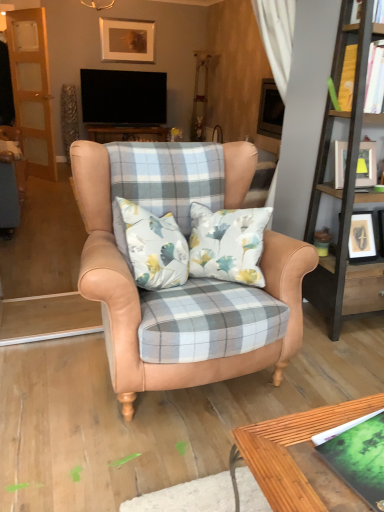
Question: Can you confirm if green matte book at lower right, the second book in the top-to-bottom sequence, is bigger than matte gold picture frame at upper center, which is counted as the 1th picture frame, starting from the top?

Choices:
 (A) yes
 (B) no

Answer: (B)

Question: Is green matte book at lower right, the 1th book in the bottom-to-top sequence, positioned before matte gold picture frame at upper center, which is the second picture frame in right-to-left order?

Choices:
 (A) no
 (B) yes

Answer: (B)

Question: Does green matte book at lower right, the 1th book in the bottom-to-top sequence, have a smaller size compared to matte gold picture frame at upper center, which appears as the 2th picture frame when viewed from the front?

Choices:
 (A) no
 (B) yes

Answer: (B)

Question: From the image's perspective, is green matte book at lower right, the 2th book in the right-to-left sequence, above matte gold picture frame at upper center, which appears as the 2th picture frame when viewed from the front?

Choices:
 (A) yes
 (B) no

Answer: (B)

Question: Considering the relative sizes of green matte book at lower right, the 1th book in the bottom-to-top sequence, and matte gold picture frame at upper center, arranged as the first picture frame when viewed from the left, in the image provided, is green matte book at lower right, the 1th book in the bottom-to-top sequence, taller than matte gold picture frame at upper center, arranged as the first picture frame when viewed from the left,?

Choices:
 (A) yes
 (B) no

Answer: (B)

Question: From a real-world perspective, is green matte book at lower right, arranged as the first book when viewed from the left, under matte gold picture frame at upper center, the second picture frame positioned from the bottom?

Choices:
 (A) yes
 (B) no

Answer: (A)

Question: From the image's perspective, is yellow paper book at upper right, which is counted as the first book, starting from the back, below wooden screen door at left?

Choices:
 (A) yes
 (B) no

Answer: (A)

Question: Is yellow paper book at upper right, which is counted as the first book, starting from the back, aimed at wooden screen door at left?

Choices:
 (A) no
 (B) yes

Answer: (A)

Question: Would you consider yellow paper book at upper right, which is counted as the 1th book, starting from the top, to be distant from wooden screen door at left?

Choices:
 (A) yes
 (B) no

Answer: (A)

Question: Is yellow paper book at upper right, the 2th book positioned from the front, at the left side of wooden screen door at left?

Choices:
 (A) yes
 (B) no

Answer: (B)

Question: From a real-world perspective, is yellow paper book at upper right, which is counted as the first book, starting from the back, located higher than wooden screen door at left?

Choices:
 (A) no
 (B) yes

Answer: (B)

Question: Is wooden screen door at left located within yellow paper book at upper right, which is counted as the first book, starting from the back?

Choices:
 (A) no
 (B) yes

Answer: (A)

Question: From a real-world perspective, is yellow paper book at upper right, which is counted as the first book, starting from the back, positioned over wooden bookshelf at right based on gravity?

Choices:
 (A) no
 (B) yes

Answer: (B)